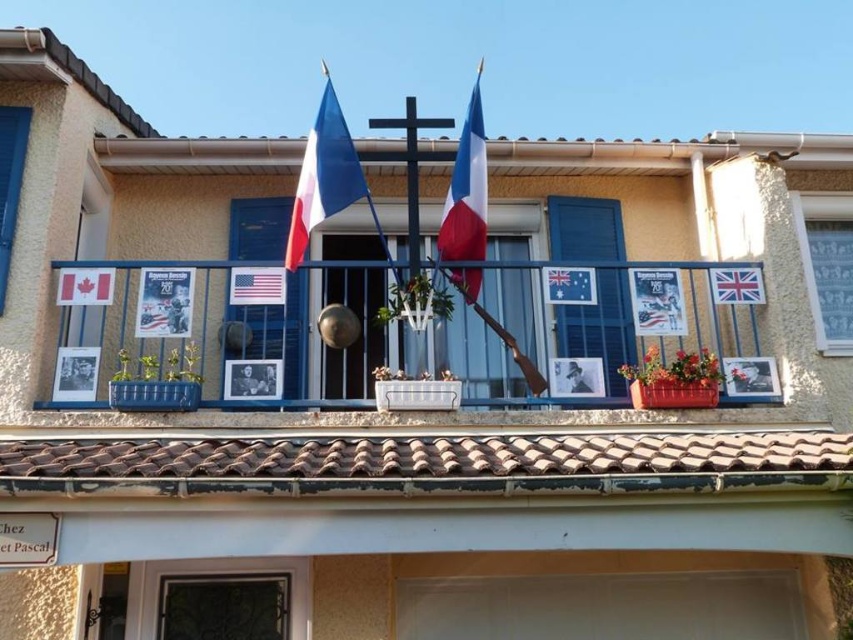
You are a window cleaner with a 5 feet long pole. You need to clean both the blue painted wood shutter at center and the blue fabric curtain at upper right. Can your pole reach both objects from your current position?

The blue painted wood shutter at center and blue fabric curtain at upper right are 5.23 feet apart from each other. Since your pole is only 5 feet long, it cannot reach both objects as the distance between them exceeds the pole length.

Looking at this image, you are a window cleaner standing on a platform that can only move horizontally. You need to clean the gold metallic bell at center and the union jack fabric flag at upper right. Since the platform can only move sideways, can you reach both objects without moving forward or backward?

The distance between the gold metallic bell at center and the union jack fabric flag at upper right is 2.63 meters. Since the platform can only move horizontally, you can reach both objects as long as the horizontal distance between them is within the platform reach. However, the given distance is the straight line distance, not the horizontal. Without knowing the horizontal component, it is impossible to determine.